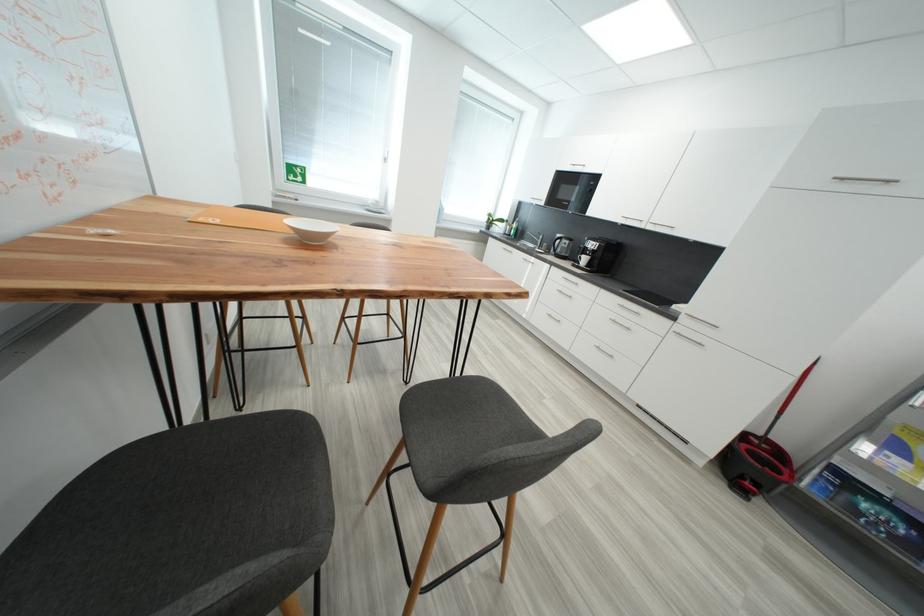
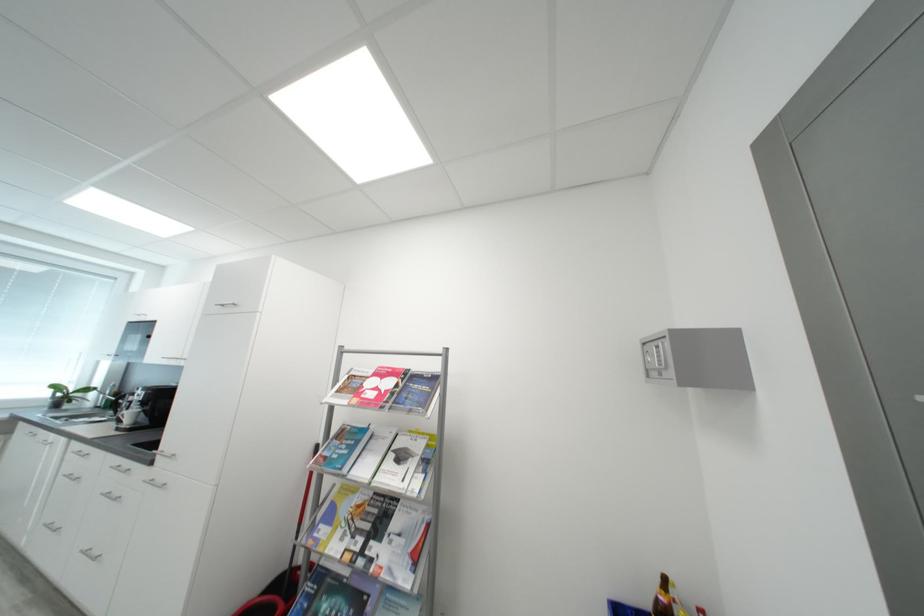
The point at (x=591, y=261) is marked in the first image. Where is the corresponding point in the second image?

(138, 416)